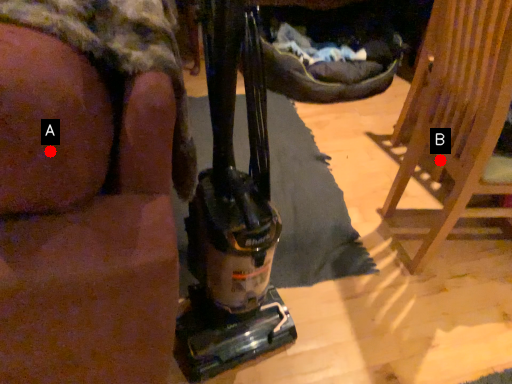
Question: Two points are circled on the image, labeled by A and B beside each circle. Which point is farther from the camera taking this photo?

Choices:
 (A) A is further
 (B) B is further

Answer: (B)